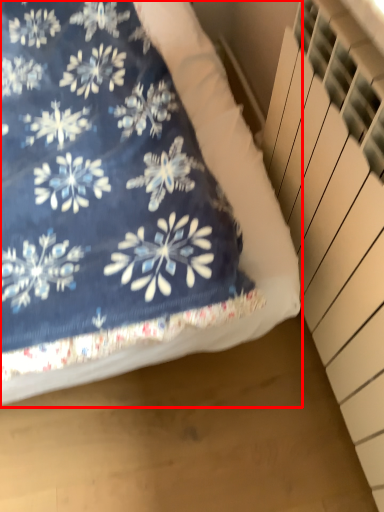
Question: From the image's perspective, what is the correct spatial positioning of bed (annotated by the red box) in reference to stairwell?

Choices:
 (A) below
 (B) above

Answer: (B)